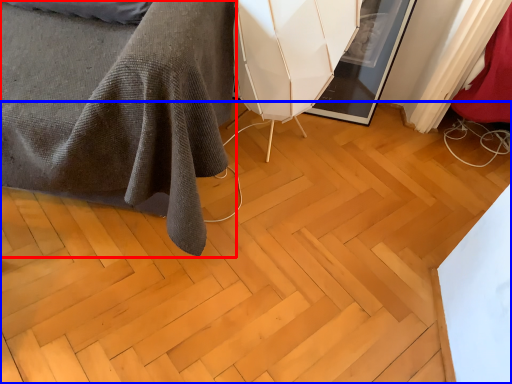
Question: Among these objects, which one is nearest to the camera, furniture (highlighted by a red box) or plywood (highlighted by a blue box)?

Choices:
 (A) furniture
 (B) plywood

Answer: (A)